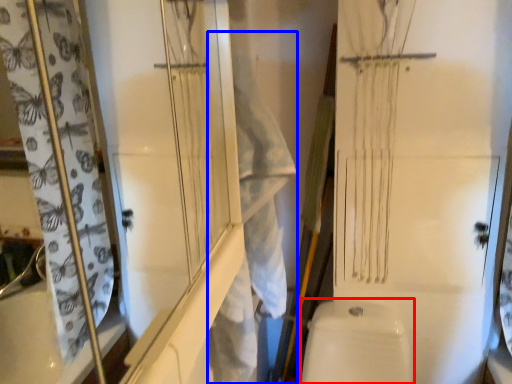
Question: Which object is further to the camera taking this photo, toilet bowl (highlighted by a red box) or laundry (highlighted by a blue box)?

Choices:
 (A) toilet bowl
 (B) laundry

Answer: (A)